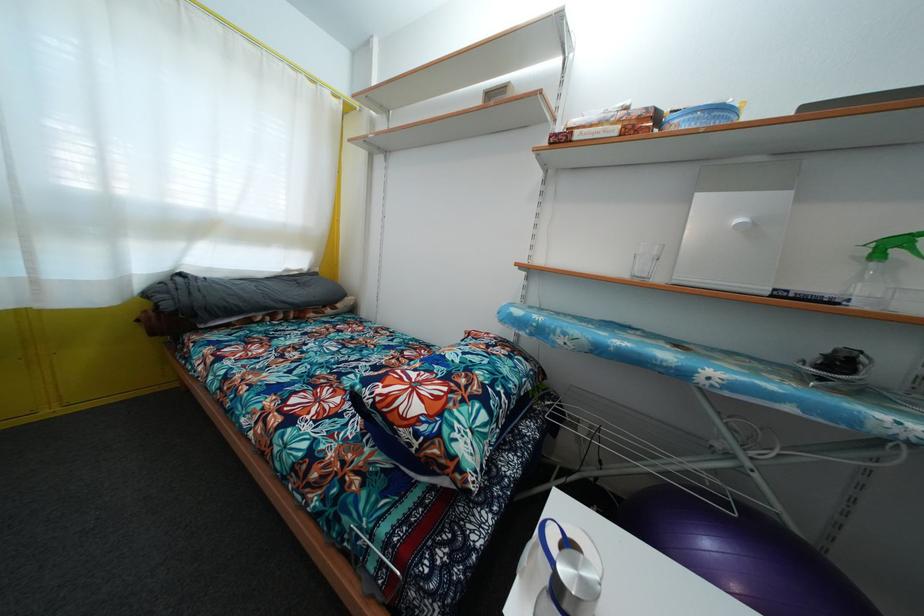
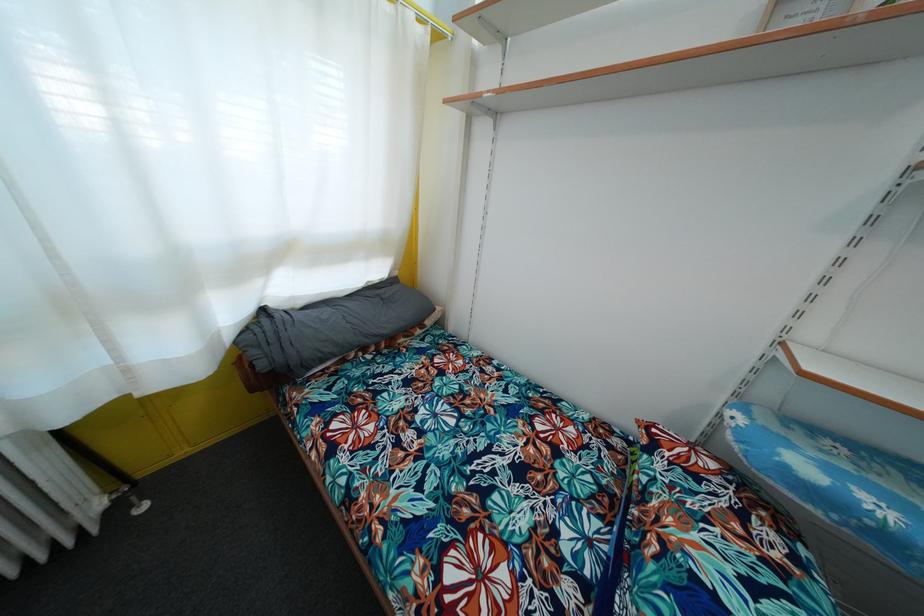
The images are taken continuously from a first-person perspective. In which direction are you moving?

The cameraman moved toward left, forward.